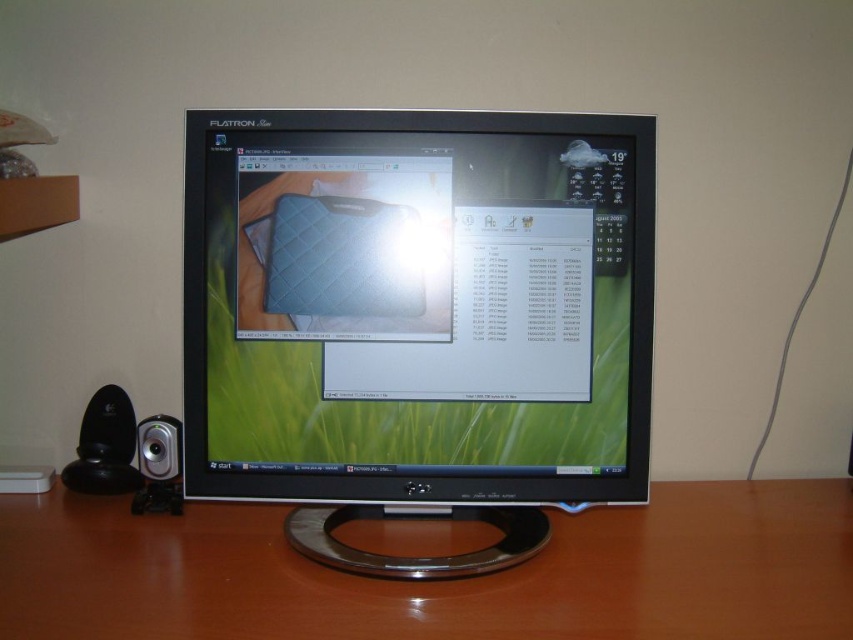
You are standing in front of a desk with a black glossy monitor at center. You need to take a photo of the monitor for a tech review. If your camera requires a minimum distance of 30 inches to focus properly, will you be able to take a clear photo from your current position?

The distance between you and the black glossy monitor at center is 28.79 inches, which is less than the required 30 inches. Therefore, you will not be able to take a clear photo from your current position.

You are trying to set up a new webcam on your desk. The webcam requires a space of 10 cm to the right of the black glossy monitor at center. Is there enough space on the brown wood computer desk at center for the webcam?

The black glossy monitor at center is positioned on the left side of the brown wood computer desk at center. Since the monitor is on the left, there is space to the right of it on the desk. The webcam requiring 10 cm to the right should fit as the desk extends beyond the monitor on that side.